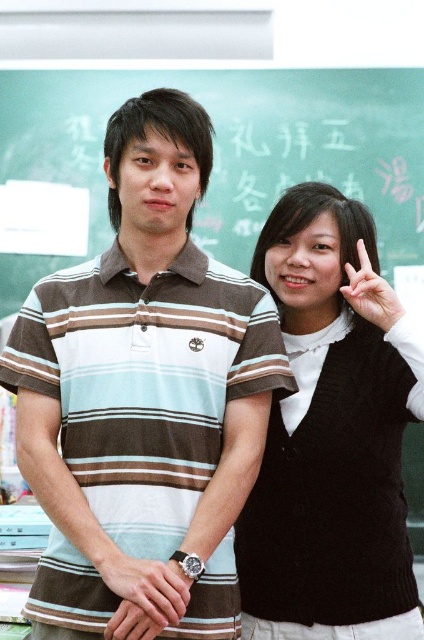
You are a photographer trying to capture a clear photo of the matte brown watch at center. However, the brown striped polo shirt at center is blocking your view. Can you move the watch closer to you or is it already positioned in a way that might require adjusting the angle?

The brown striped polo shirt at center is further to the viewer than matte brown watch at center, meaning the watch is behind the shirt. To capture the watch clearly, you need to adjust your angle to avoid the obstruction caused by the brown striped polo shirt at center.

Based on the photo, you are a photographer standing in front of the scene. You want to take a photo of the matte black hand at center and the green chalkboard at upper center. If the camera can only focus on objects within 5 feet, will both objects be in focus?

The green chalkboard at upper center is 5.93 feet from matte black hand at center. Since the distance between them is more than 5 feet, the camera cannot focus on both objects simultaneously within the 5 feet range. One will be out of focus.

You are a student in the classroom looking at the green chalkboard at upper center and the matte brown watch at center. Which object is higher up in the image?

The green chalkboard at upper center is taller than the matte brown watch at center, so the green chalkboard at upper center is higher up in the image.